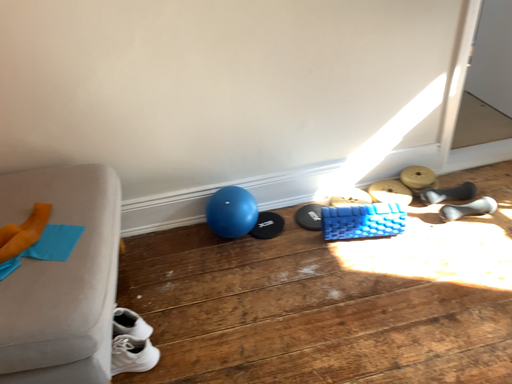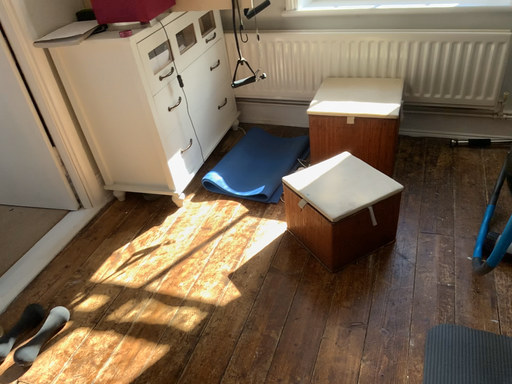
Question: Which way did the camera rotate in the video?

Choices:
 (A) rotated upward
 (B) rotated downward

Answer: (A)